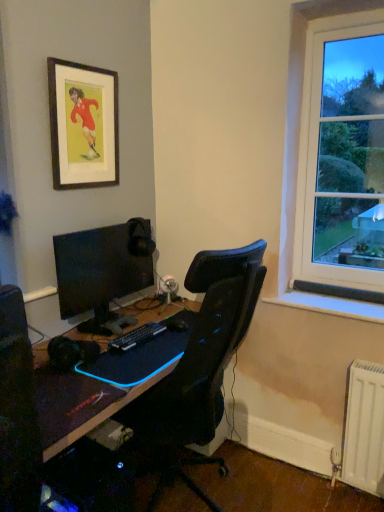
Question: From the image's perspective, is black matte desk at center above metallic silver speaker at center?

Choices:
 (A) no
 (B) yes

Answer: (A)

Question: Can you confirm if black matte desk at center is smaller than metallic silver speaker at center?

Choices:
 (A) yes
 (B) no

Answer: (B)

Question: Is black matte desk at center oriented away from metallic silver speaker at center?

Choices:
 (A) yes
 (B) no

Answer: (B)

Question: Is black matte desk at center directly adjacent to metallic silver speaker at center?

Choices:
 (A) no
 (B) yes

Answer: (A)

Question: Considering the relative sizes of black matte desk at center and metallic silver speaker at center in the image provided, is black matte desk at center taller than metallic silver speaker at center?

Choices:
 (A) no
 (B) yes

Answer: (A)

Question: Is point (132, 337) closer or farther from the camera than point (69, 387)?

Choices:
 (A) closer
 (B) farther

Answer: (B)

Question: In the image, is black plastic keyboard at center on the left side or the right side of black matte desk at center?

Choices:
 (A) left
 (B) right

Answer: (B)

Question: From a real-world perspective, is black plastic keyboard at center positioned above or below black matte desk at center?

Choices:
 (A) above
 (B) below

Answer: (A)

Question: In the image, is black plastic keyboard at center positioned in front of or behind black matte desk at center?

Choices:
 (A) front
 (B) behind

Answer: (B)

Question: From the image's perspective, is metallic silver speaker at center above or below wooden framed print at upper left?

Choices:
 (A) above
 (B) below

Answer: (B)

Question: In the image, is metallic silver speaker at center positioned in front of or behind wooden framed print at upper left?

Choices:
 (A) front
 (B) behind

Answer: (B)

Question: Looking at their shapes, would you say metallic silver speaker at center is wider or thinner than wooden framed print at upper left?

Choices:
 (A) thin
 (B) wide

Answer: (B)

Question: Is point (168, 283) positioned closer to the camera than point (54, 61)?

Choices:
 (A) farther
 (B) closer

Answer: (A)

Question: Based on their sizes in the image, would you say black matte desk at center is bigger or smaller than black plastic keyboard at center?

Choices:
 (A) big
 (B) small

Answer: (A)

Question: In the image, is black matte desk at center positioned in front of or behind black plastic keyboard at center?

Choices:
 (A) behind
 (B) front

Answer: (B)